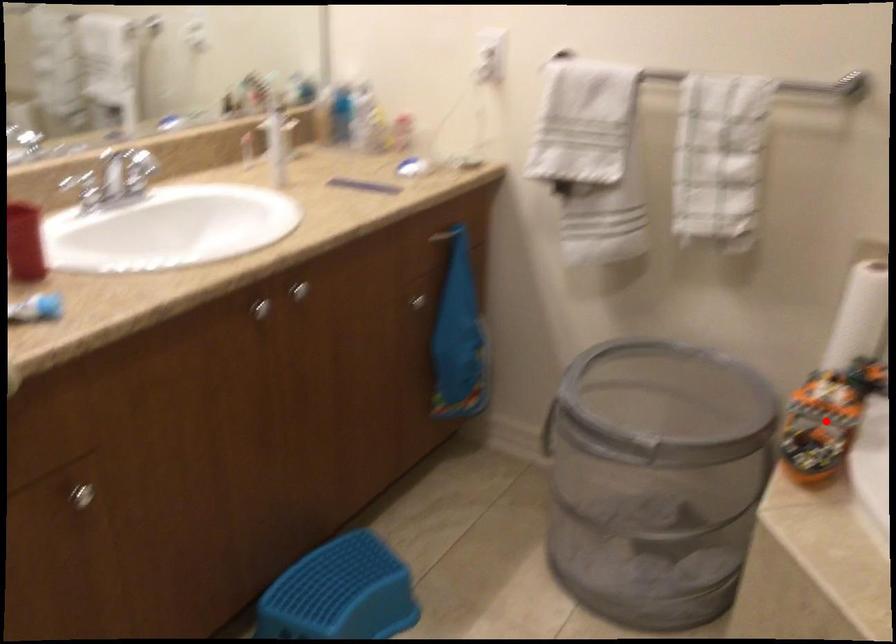
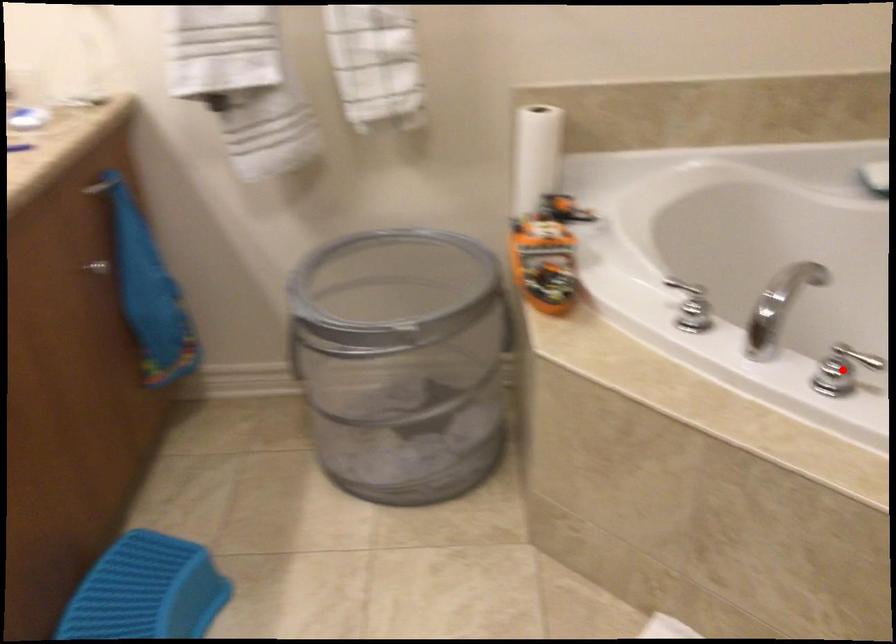
I am providing you with two images of the same scene from different viewpoints. A red point is marked on the first image and another point is marked on the second image. Are the points marked in image1 and image2 representing the same 3D position?

No